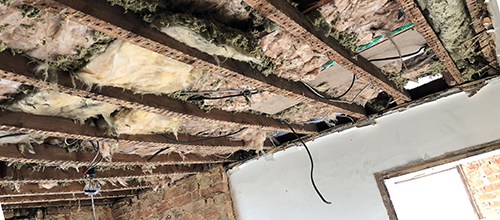
Locate an element on the screen. The width and height of the screenshot is (500, 220). back wall is located at coordinates point(352,167).